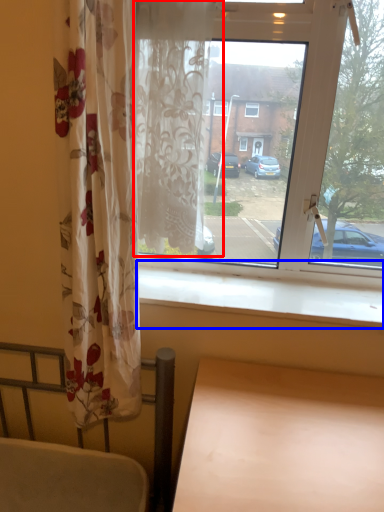
Question: Which object is closer to the camera taking this photo, curtain (highlighted by a red box) or window sill (highlighted by a blue box)?

Choices:
 (A) curtain
 (B) window sill

Answer: (A)